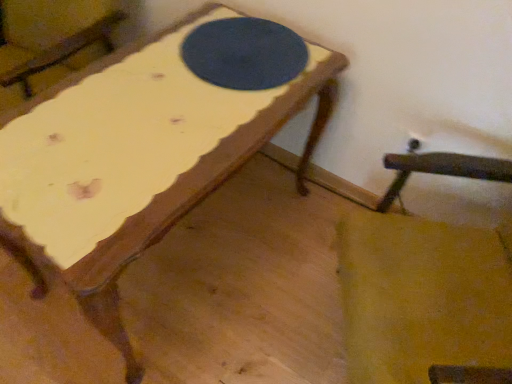
Question: From the image's perspective, is wooden rocking chair at lower right positioned above or below dark blue felt table tennis table at center?

Choices:
 (A) below
 (B) above

Answer: (A)

Question: Is wooden rocking chair at lower right situated inside dark blue felt table tennis table at center or outside?

Choices:
 (A) outside
 (B) inside

Answer: (A)

Question: Is wooden rocking chair at lower right in front of or behind dark blue felt table tennis table at center in the image?

Choices:
 (A) front
 (B) behind

Answer: (A)

Question: In the image, is dark blue felt table tennis table at center positioned in front of or behind wooden rocking chair at lower right?

Choices:
 (A) behind
 (B) front

Answer: (A)

Question: Considering the positions of dark blue felt table tennis table at center and wooden rocking chair at lower right in the image, is dark blue felt table tennis table at center bigger or smaller than wooden rocking chair at lower right?

Choices:
 (A) small
 (B) big

Answer: (A)

Question: From a real-world perspective, is dark blue felt table tennis table at center positioned above or below wooden rocking chair at lower right?

Choices:
 (A) below
 (B) above

Answer: (B)

Question: From the image's perspective, is dark blue felt table tennis table at center located above or below wooden rocking chair at lower right?

Choices:
 (A) below
 (B) above

Answer: (B)